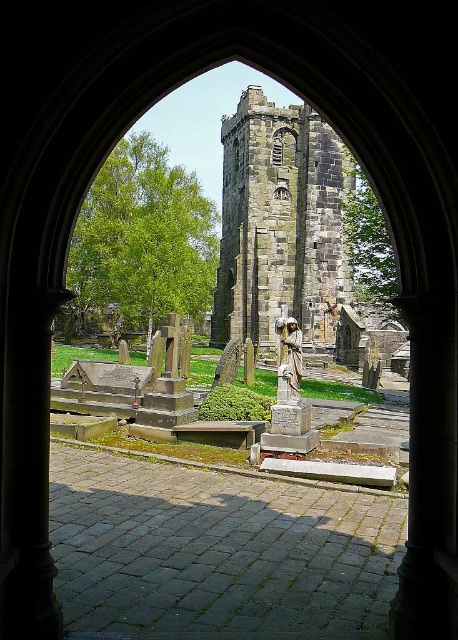
Between stone tower at center and polished bronze statue at center, which one is positioned lower?

polished bronze statue at center is lower down.

Between stone tower at center and polished bronze statue at center, which one has less height?

Standing shorter between the two is polished bronze statue at center.

Locate an element on the screen. stone tower at center is located at coordinates (279, 221).

In order to click on stone tower at center in this screenshot , I will do `click(279, 221)`.